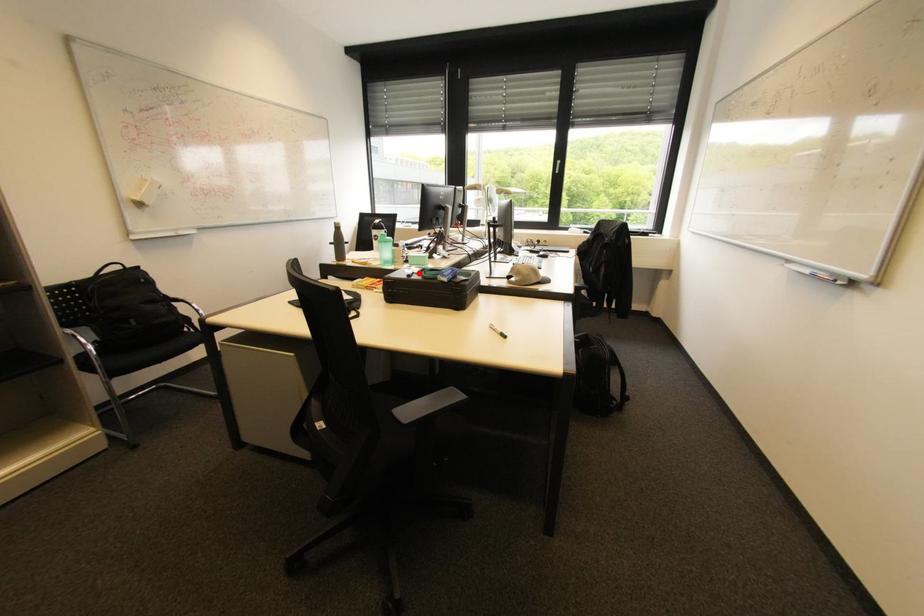
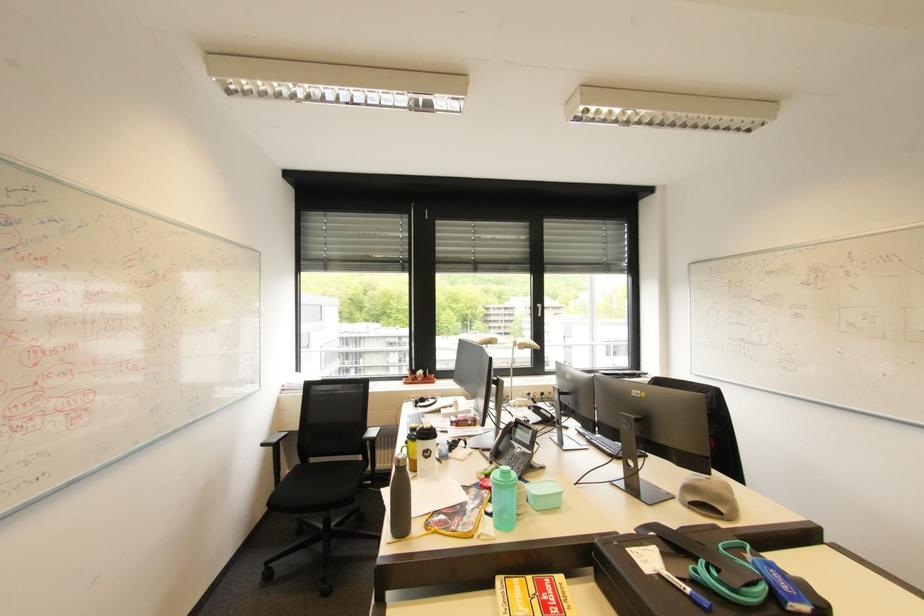
Locate, in the second image, the point that corresponds to the highlighted location in the first image.

(685, 581)